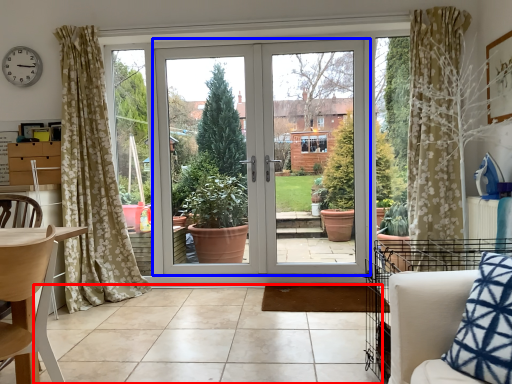
Question: Which object is closer to the camera taking this photo, tile (highlighted by a red box) or door (highlighted by a blue box)?

Choices:
 (A) tile
 (B) door

Answer: (A)